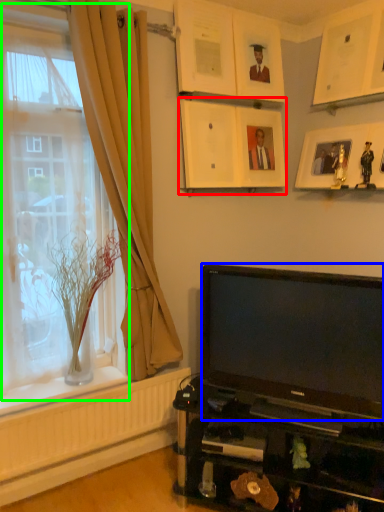
Question: Which is farther away from picture frame (highlighted by a red box)? television (highlighted by a blue box) or window (highlighted by a green box)?

Choices:
 (A) television
 (B) window

Answer: (A)